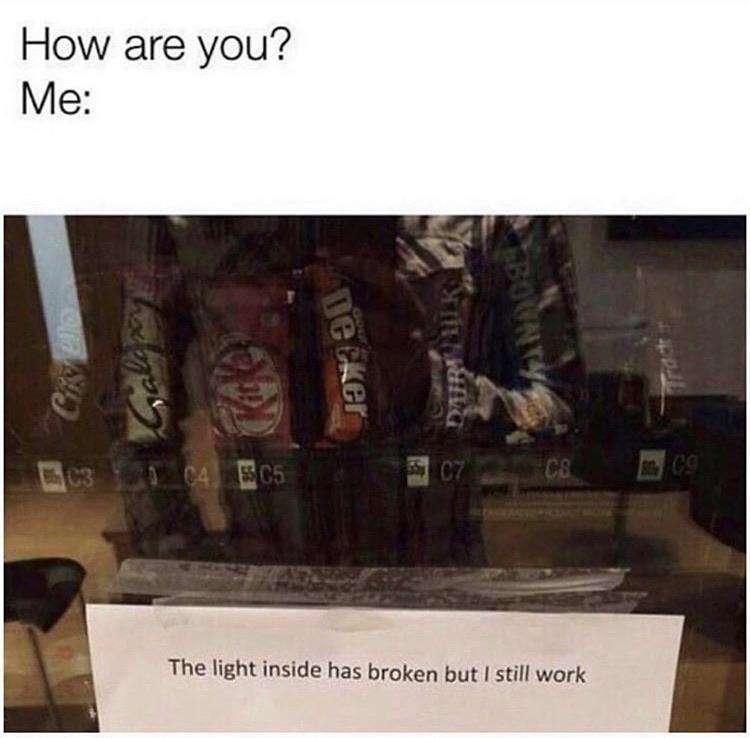
Identify the location of white rectangular piece of paper. Image resolution: width=750 pixels, height=738 pixels. (385, 623).